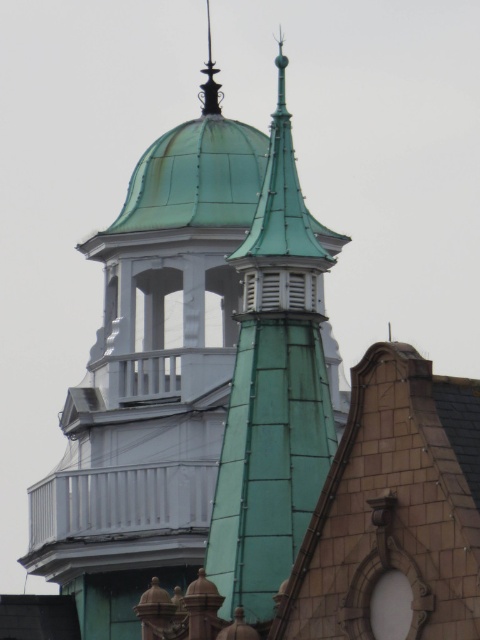
Consider the image. You are an architect inspecting the building. You notice the green copper roof at center and the polished dark metal spire at upper center. Which one is located higher up in the image?

The polished dark metal spire at upper center is higher up because it is positioned above the green copper roof at center.

You are a bird with a wingspan of 12 feet. You want to fly between the green copper roof at center and the polished dark metal spire at upper center. Can you fit through the space between them without touching either structure?

The distance between the green copper roof at center and the polished dark metal spire at upper center is 152.17 feet. Since your wingspan is only 12 feet, you have plenty of space to fly between them without touching either structure.